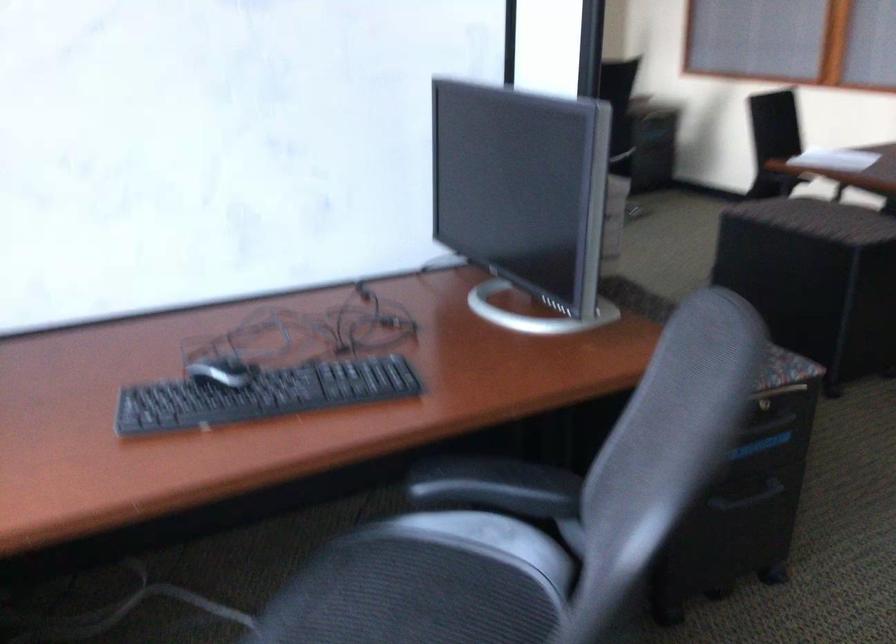
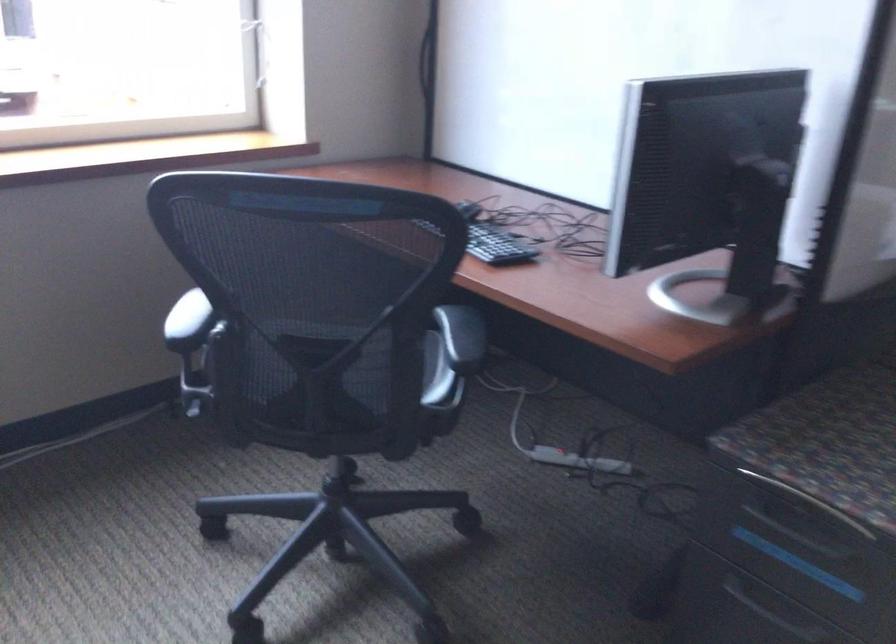
In the second image, find the point that corresponds to point 757,493 in the first image.

(778, 614)